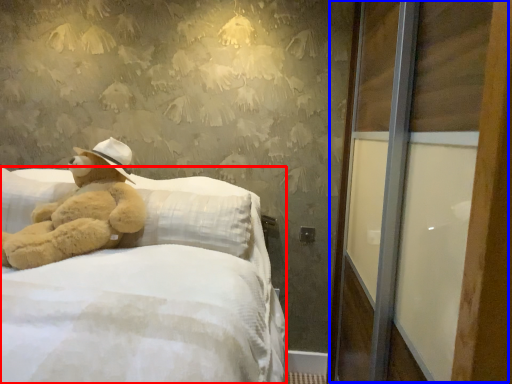
Question: Which of the following is the closest to the observer, bed (highlighted by a red box) or screen door (highlighted by a blue box)?

Choices:
 (A) bed
 (B) screen door

Answer: (A)